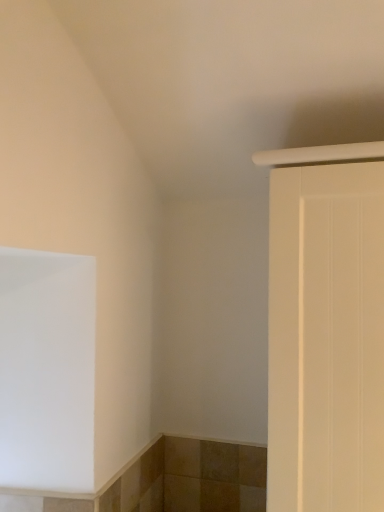
Locate an element on the screen. This screenshot has width=384, height=512. white smooth door at right is located at coordinates (326, 338).

The width and height of the screenshot is (384, 512). What do you see at coordinates (326, 338) in the screenshot? I see `white smooth door at right` at bounding box center [326, 338].

At what (x,y) coordinates should I click in order to perform the action: click on white smooth door at right. Please return your answer as a coordinate pair (x, y). The image size is (384, 512). Looking at the image, I should click on (326, 338).